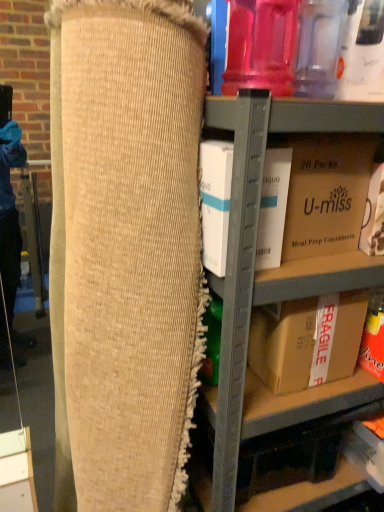
Question: Should I look upward or downward to see natural burlap bean bag chair at center?

Choices:
 (A) down
 (B) up

Answer: (A)

Question: Is brown cardboard box at upper right, the first storage box from the left, positioned far away from cardboard box at center?

Choices:
 (A) no
 (B) yes

Answer: (A)

Question: Would you say brown cardboard box at upper right, which is counted as the first storage box, starting from the top, is outside cardboard box at center?

Choices:
 (A) yes
 (B) no

Answer: (B)

Question: From the image's perspective, does brown cardboard box at upper right, the first storage box from the left, appear lower than cardboard box at center?

Choices:
 (A) no
 (B) yes

Answer: (A)

Question: Does brown cardboard box at upper right, the first storage box from the left, have a smaller size compared to cardboard box at center?

Choices:
 (A) no
 (B) yes

Answer: (B)

Question: Does brown cardboard box at upper right, marked as the second storage box in a right-to-left arrangement, touch cardboard box at center?

Choices:
 (A) yes
 (B) no

Answer: (A)

Question: Can you confirm if brown cardboard box at upper right, which is counted as the first storage box, starting from the top, is shorter than cardboard box at center?

Choices:
 (A) yes
 (B) no

Answer: (A)

Question: From a real-world perspective, is brown cardboard box at lower right, acting as the second box starting from the top, located beneath white cardboard box at center, the 2th box positioned from the bottom?

Choices:
 (A) no
 (B) yes

Answer: (B)

Question: Is brown cardboard box at lower right, arranged as the first box when ordered from the bottom, turned away from white cardboard box at center, marked as the 2th box in a back-to-front arrangement?

Choices:
 (A) no
 (B) yes

Answer: (A)

Question: Considering the relative sizes of brown cardboard box at lower right, marked as the second box in a front-to-back arrangement, and white cardboard box at center, the 1th box in the top-to-bottom sequence, in the image provided, is brown cardboard box at lower right, marked as the second box in a front-to-back arrangement, shorter than white cardboard box at center, the 1th box in the top-to-bottom sequence,?

Choices:
 (A) yes
 (B) no

Answer: (A)

Question: Is brown cardboard box at lower right, arranged as the first box when ordered from the bottom, facing towards white cardboard box at center, the 1th box in the top-to-bottom sequence?

Choices:
 (A) no
 (B) yes

Answer: (A)

Question: Is brown cardboard box at lower right, the 1th box viewed from the back, bigger than white cardboard box at center, the 2th box positioned from the bottom?

Choices:
 (A) no
 (B) yes

Answer: (B)

Question: Considering the relative positions of brown cardboard box at lower right, arranged as the first box when ordered from the bottom, and white cardboard box at center, the 1th box in the top-to-bottom sequence, in the image provided, is brown cardboard box at lower right, arranged as the first box when ordered from the bottom, to the right of white cardboard box at center, the 1th box in the top-to-bottom sequence, from the viewer's perspective?

Choices:
 (A) no
 (B) yes

Answer: (B)

Question: Considering the relative sizes of brown cardboard box at upper right, marked as the second storage box in a right-to-left arrangement, and matte cardboard box at lower right, positioned as the first storage box in right-to-left order, in the image provided, is brown cardboard box at upper right, marked as the second storage box in a right-to-left arrangement, bigger than matte cardboard box at lower right, positioned as the first storage box in right-to-left order,?

Choices:
 (A) no
 (B) yes

Answer: (B)